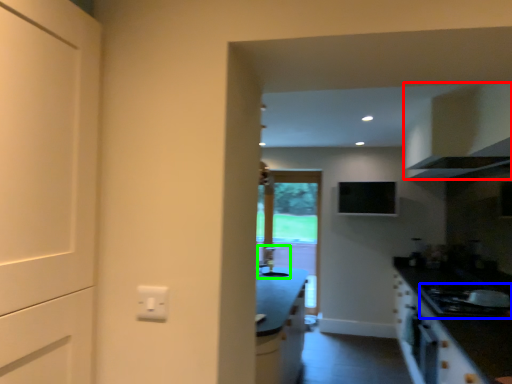
Question: Which is farther away from cabinetry (highlighted by a red box)? gas stove (highlighted by a blue box) or sink (highlighted by a green box)?

Choices:
 (A) gas stove
 (B) sink

Answer: (B)